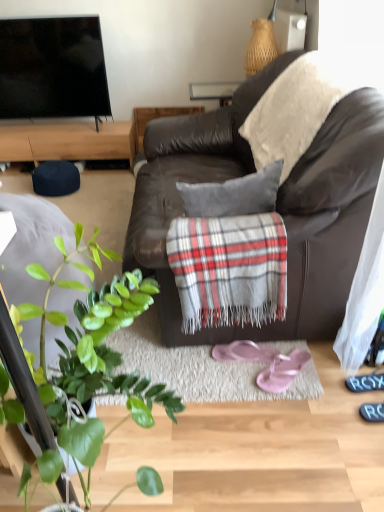
You are a GUI agent. You are given a task and a screenshot of the screen. Output one action in this format:
    pyautogui.click(x=<x>, y=<y>)
    Task: Click on the free region under flat screen tv at upper left (from a real-world perspective)
    Image resolution: width=384 pixels, height=512 pixels.
    Given the screenshot: What is the action you would take?
    pyautogui.click(x=48, y=120)